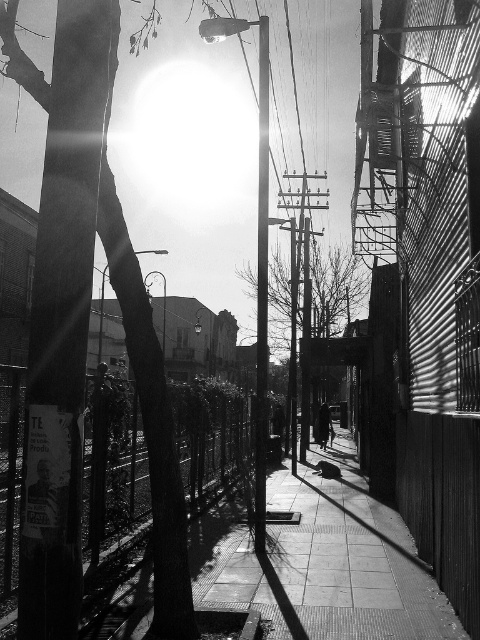
Question: Estimate the real-world distances between objects in this image. Which object is farther from the smooth metal pole at center?

Choices:
 (A) dark fabric coat at center
 (B) silhouette bare tree at center

Answer: (A)

Question: Which object is closer to the camera taking this photo?

Choices:
 (A) smooth concrete pavement at center
 (B) dark fabric coat at center
 (C) silhouette bare tree at center
 (D) smooth metal pole at center

Answer: (A)

Question: Can you confirm if smooth concrete pavement at center is positioned to the right of smooth metal pole at center?

Choices:
 (A) yes
 (B) no

Answer: (A)

Question: Which point is closer to the camera?

Choices:
 (A) silhouette bare tree at center
 (B) dark fabric coat at center
 (C) smooth concrete pavement at center

Answer: (C)

Question: Does smooth concrete pavement at center appear over silhouette bare tree at center?

Choices:
 (A) yes
 (B) no

Answer: (B)

Question: Can you confirm if smooth concrete pavement at center is positioned to the right of silhouette bare tree at center?

Choices:
 (A) yes
 (B) no

Answer: (B)